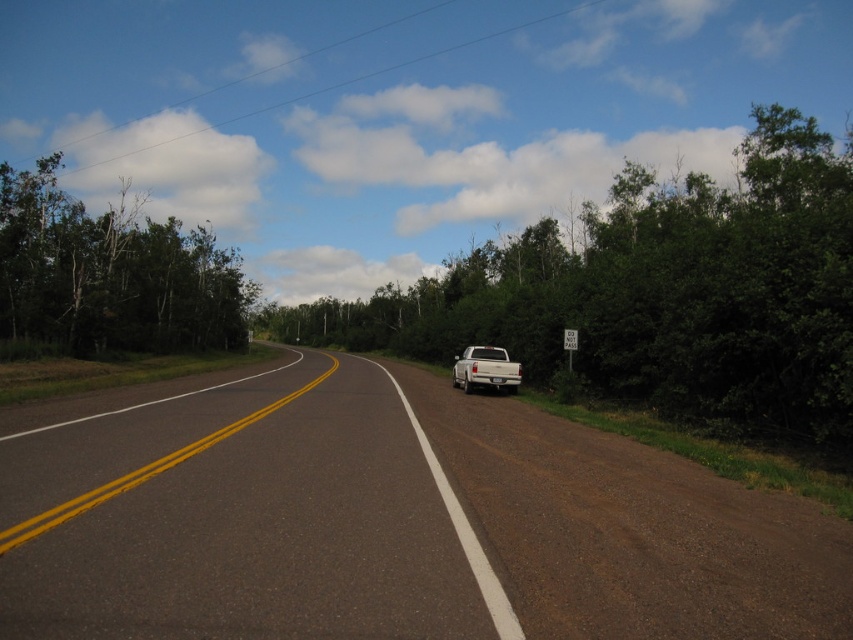
You are standing at the point marked by coordinates (392, 522). Looking around, you see the black asphalt road at center. Which direction should you walk to avoid the road and head towards the dirt shoulder where the white pickup truck is parked?

The black asphalt road at center is located at point (392, 522). To avoid the road and head towards the dirt shoulder where the white pickup truck is parked, you should walk to the right side of the road.